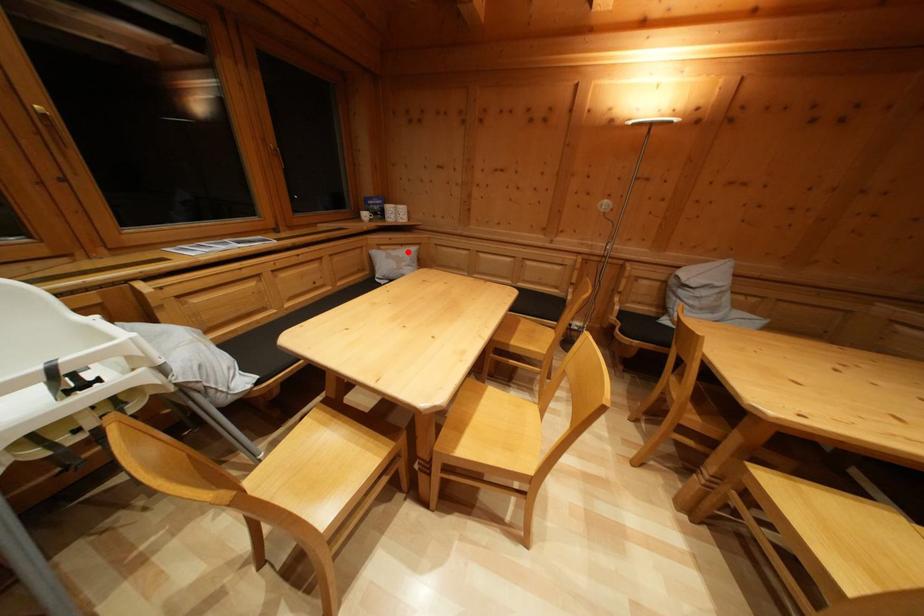
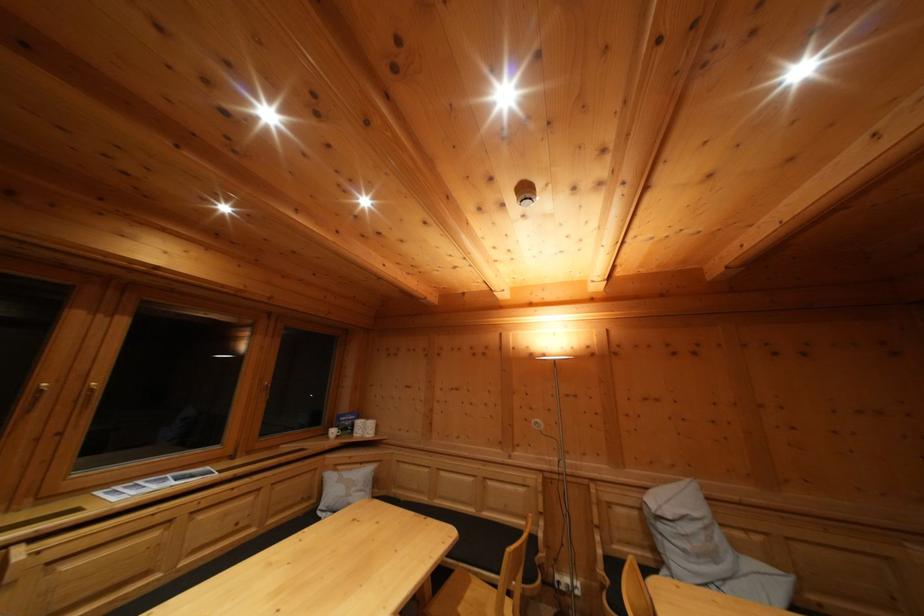
Locate, in the second image, the point that corresponds to the highlighted location in the first image.

(368, 469)